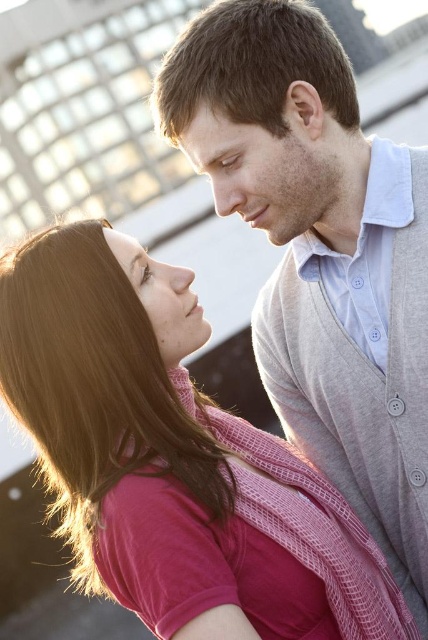
Does pink knitted sweater at center have a greater height compared to light gray knit sweater at upper right?

Incorrect, pink knitted sweater at center's height is not larger of light gray knit sweater at upper right's.

You are a GUI agent. You are given a task and a screenshot of the screen. Output one action in this format:
    pyautogui.click(x=<x>, y=<y>)
    Task: Click on the pink knitted sweater at center
    This screenshot has height=640, width=428.
    Given the screenshot: What is the action you would take?
    pyautogui.click(x=172, y=458)

What do you see at coordinates (172, 458) in the screenshot? I see `pink knitted sweater at center` at bounding box center [172, 458].

Image resolution: width=428 pixels, height=640 pixels. Find the location of `pink knitted sweater at center`. pink knitted sweater at center is located at coordinates (172, 458).

Is point (162, 362) positioned after point (237, 131)?

Yes, point (162, 362) is farther from viewer.

Where is `pink knitted sweater at center`? pink knitted sweater at center is located at coordinates (172, 458).

Between light gray knit sweater at upper right and matte skin forehead at upper center, which one is positioned lower?

light gray knit sweater at upper right is below.

Who is more distant from viewer, (288, 145) or (256, 124)?

The point (288, 145) is more distant.

Who is more distant from viewer, (341, 49) or (196, 116)?

The point (341, 49) is behind.

You are a GUI agent. You are given a task and a screenshot of the screen. Output one action in this format:
    pyautogui.click(x=<x>, y=<y>)
    Task: Click on the light gray knit sweater at upper right
    The image size is (428, 640).
    Given the screenshot: What is the action you would take?
    pyautogui.click(x=324, y=259)